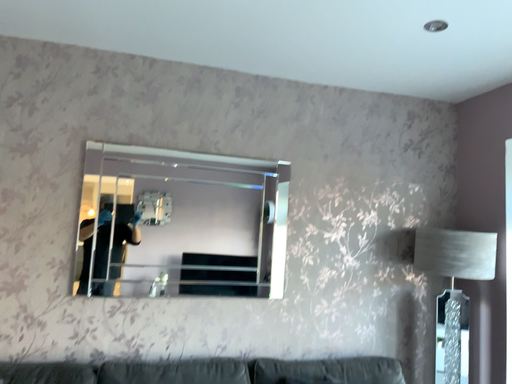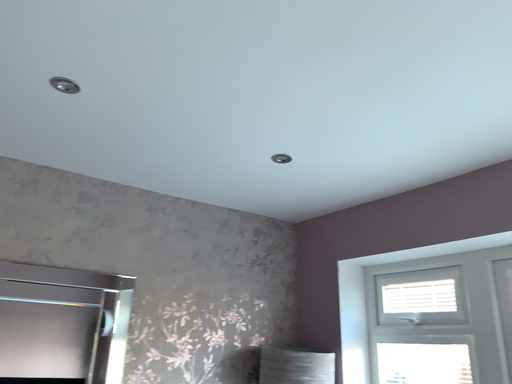
Question: Which way did the camera rotate in the video?

Choices:
 (A) rotated right
 (B) rotated left

Answer: (A)